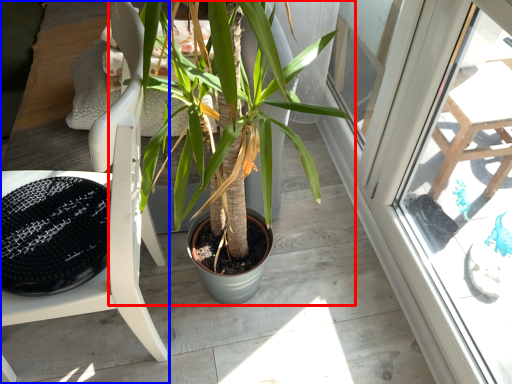
Question: Which object is further to the camera taking this photo, houseplant (highlighted by a red box) or chair (highlighted by a blue box)?

Choices:
 (A) houseplant
 (B) chair

Answer: (A)